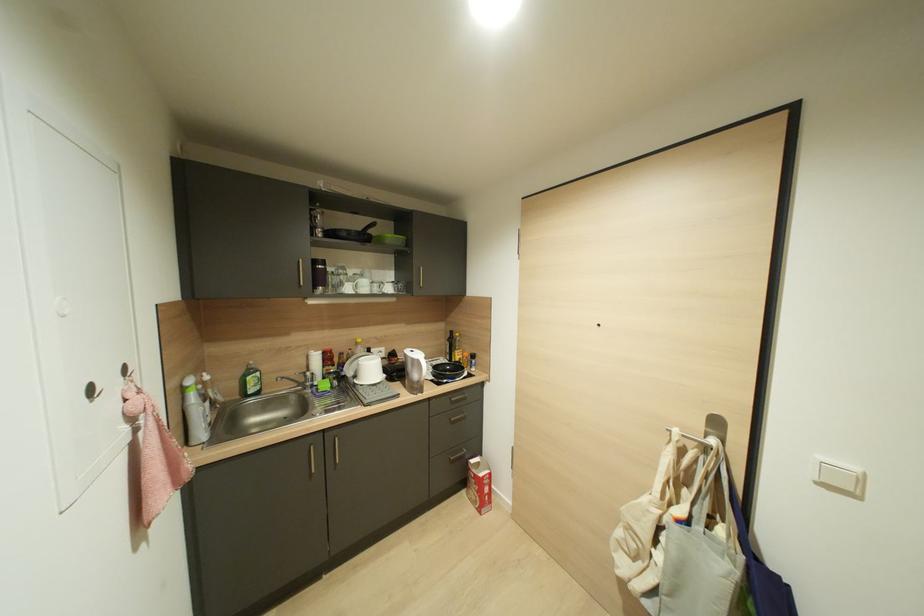
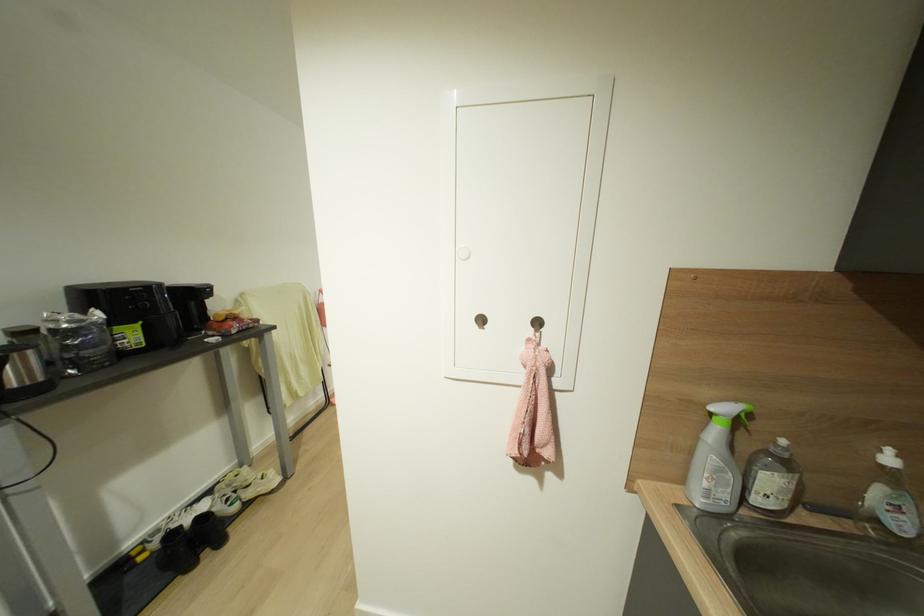
Where in the second image is the point corresponding to point (183, 389) from the first image?

(711, 411)